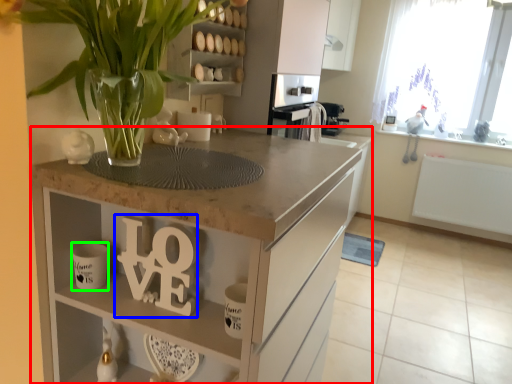
Question: Based on their relative distances, which object is farther from countertop (highlighted by a red box)? Choose from alphabet (highlighted by a blue box) and mug (highlighted by a green box).

Choices:
 (A) alphabet
 (B) mug

Answer: (B)